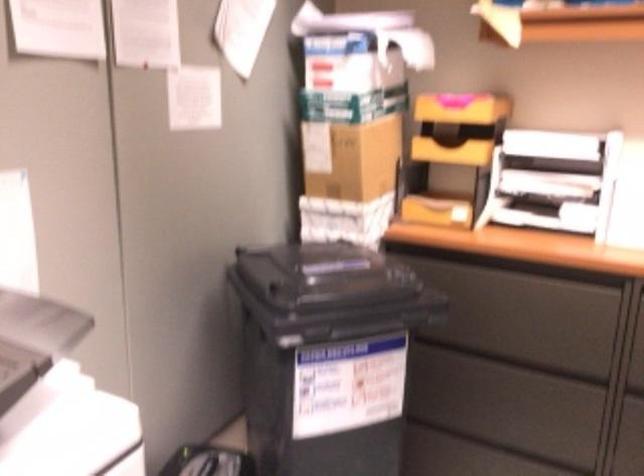
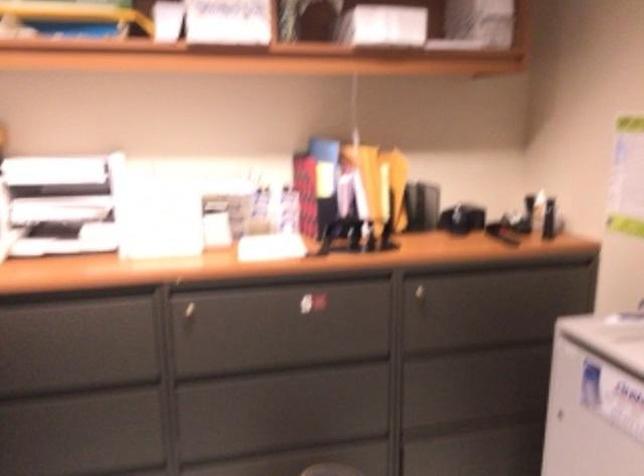
Question: The first image is from the beginning of the video and the second image is from the end. How did the camera likely rotate when shooting the video?

Choices:
 (A) Left
 (B) Right
 (C) Up
 (D) Down

Answer: (B)